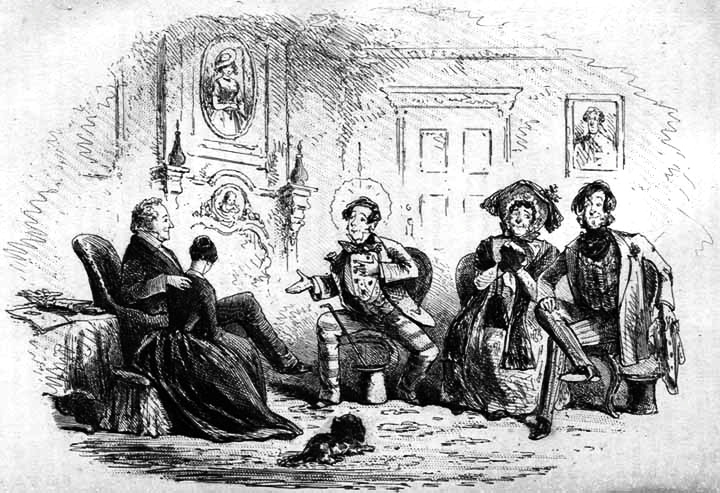
Find the location of a particular element. The image size is (720, 493). square picture on wall is located at coordinates (589, 132), (606, 155), (582, 158), (603, 112).